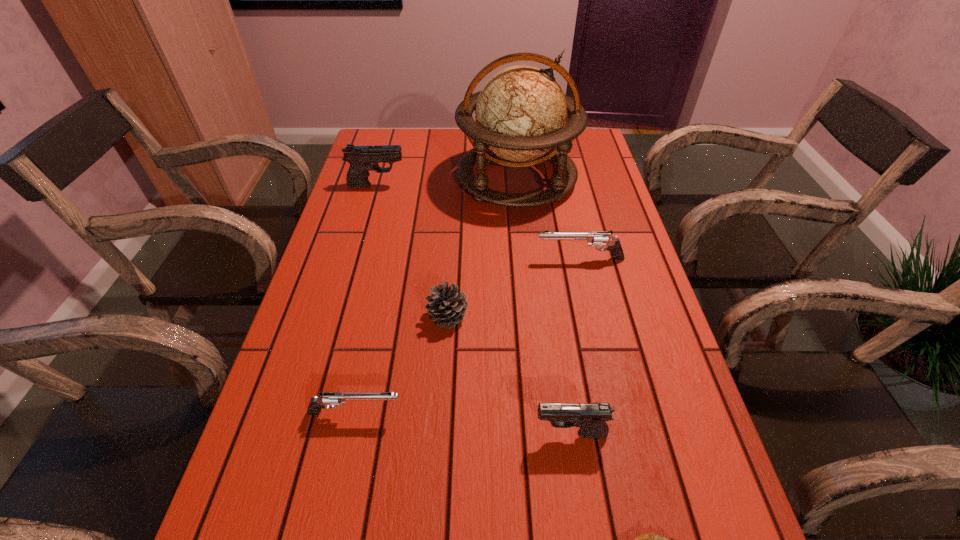
At what (x,y) coordinates should I click in order to perform the action: click on the tallest object. Please return your answer as a coordinate pair (x, y). The image size is (960, 540). Looking at the image, I should click on (521, 112).

At what (x,y) coordinates should I click in order to perform the action: click on the left black pistol. Please return your answer as a coordinate pair (x, y). Image resolution: width=960 pixels, height=540 pixels. Looking at the image, I should click on (362, 159).

I want to click on the second tallest object, so click(362, 159).

Identify the location of the right black pistol. The image size is (960, 540). (x=591, y=418).

Identify the location of the second nearest object. This screenshot has height=540, width=960. (591, 418).

This screenshot has height=540, width=960. Find the location of `pinecone`. pinecone is located at coordinates (447, 306).

Where is `the farther silver pistol`? The image size is (960, 540). the farther silver pistol is located at coordinates (594, 238).

This screenshot has width=960, height=540. What are the coordinates of `the bigger silver pistol` in the screenshot? It's located at click(594, 238).

The height and width of the screenshot is (540, 960). I want to click on the smaller silver pistol, so click(316, 404).

Where is `the left silver pistol`? Image resolution: width=960 pixels, height=540 pixels. the left silver pistol is located at coordinates (316, 404).